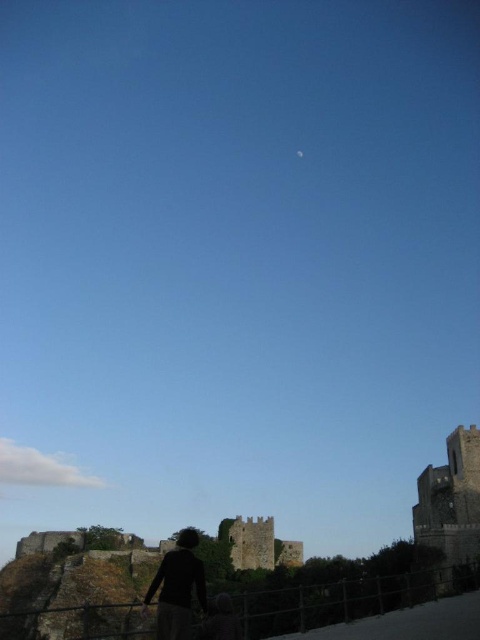
Question: Can you confirm if dark gray stone fort at right is positioned below silhouette fabric person at lower center?

Choices:
 (A) yes
 (B) no

Answer: (B)

Question: Which point appears farthest from the camera in this image?

Choices:
 (A) (302, 550)
 (B) (158, 602)

Answer: (A)

Question: Which point is farther from the camera taking this photo?

Choices:
 (A) (190, 540)
 (B) (446, 451)

Answer: (B)

Question: Does dark gray stone fort at right appear under silhouette fabric person at lower center?

Choices:
 (A) no
 (B) yes

Answer: (A)

Question: Is the position of dark gray stone fort at right less distant than that of silhouette fabric person at lower center?

Choices:
 (A) no
 (B) yes

Answer: (A)

Question: Which object appears farthest from the camera in this image?

Choices:
 (A) dark gray stone fort at right
 (B) stone medieval tower at center

Answer: (B)